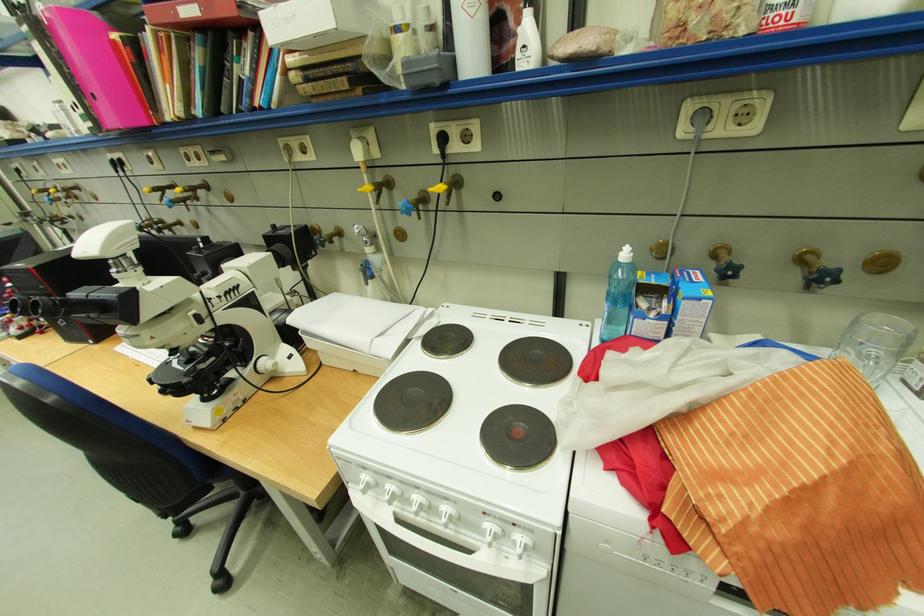
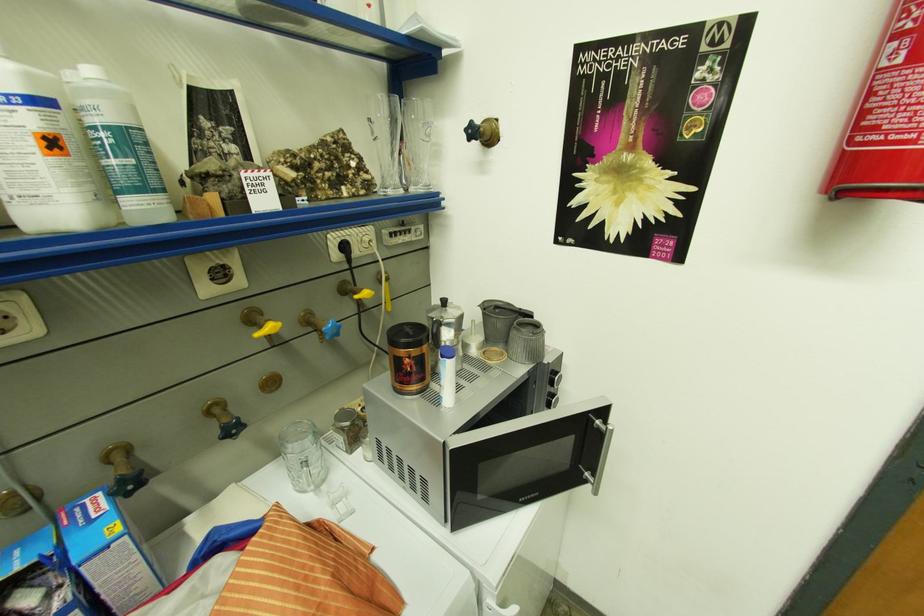
In the second image, find the point that corresponds to pixel 675 259 in the first image.

(42, 509)